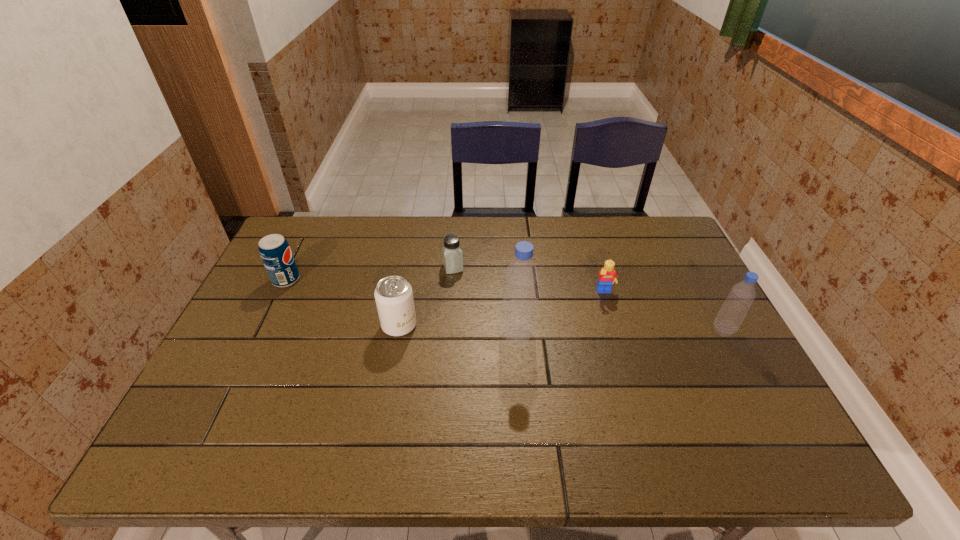
Identify the location of vacant region between the left bottle and the right soda can. (458, 330).

Find the location of `free space between the right soda can and the right bottle`. free space between the right soda can and the right bottle is located at coordinates (562, 328).

Where is `free area in between the left bottle and the second object from right to left`? The width and height of the screenshot is (960, 540). free area in between the left bottle and the second object from right to left is located at coordinates (561, 314).

This screenshot has height=540, width=960. I want to click on free space that is in between the Lego and the second tallest object, so click(x=664, y=312).

At what (x,y) coordinates should I click in order to perform the action: click on free space between the leftmost object and the second object from left to right. Please return your answer as a coordinate pair (x, y). This screenshot has height=540, width=960. Looking at the image, I should click on (343, 302).

Where is `object that is the second nearest to the right bottle`? object that is the second nearest to the right bottle is located at coordinates (518, 320).

Identify which object is the fifth closest to the fourth object from right to left. Please provide its 2D coordinates. Your answer should be formatted as a tuple, i.e. [(x, y)], where the tuple contains the x and y coordinates of a point satisfying the conditions above.

[(733, 311)]

At what (x,y) coordinates should I click in order to perform the action: click on free space that satisfies the following two spatial constraints: 1. on the face of the Lego; 2. on the right side of the second tallest object. Please return your answer as a coordinate pair (x, y). The width and height of the screenshot is (960, 540). Looking at the image, I should click on (616, 330).